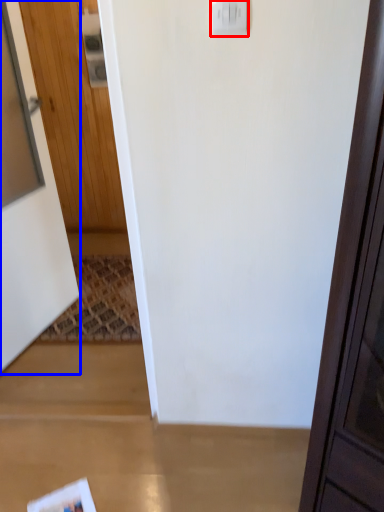
Question: Which point is further to the camera, light switch (highlighted by a red box) or door (highlighted by a blue box)?

Choices:
 (A) light switch
 (B) door

Answer: (B)